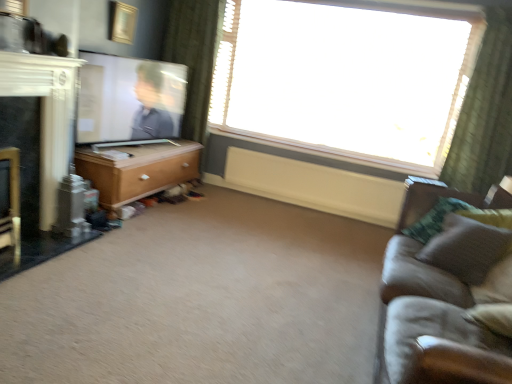
Question: From their relative heights in the image, would you say green textured curtain at upper right is taller or shorter than matte white tv at left?

Choices:
 (A) short
 (B) tall

Answer: (B)

Question: Relative to matte white tv at left, is green textured curtain at upper right in front or behind?

Choices:
 (A) front
 (B) behind

Answer: (B)

Question: Based on their relative distances, which object is nearer to the suede gray couch at right?

Choices:
 (A) black glossy fireplace at left
 (B) gold metallic picture frame at upper center
 (C) wooden chest of drawers at left
 (D) carpet at center
 (E) matte white tv at left

Answer: (D)

Question: Which object is positioned closest to the carpet at center?

Choices:
 (A) matte white tv at left
 (B) transparent glass window at upper center
 (C) gold metallic picture frame at upper center
 (D) wooden chest of drawers at left
 (E) green textured curtain at upper right

Answer: (D)